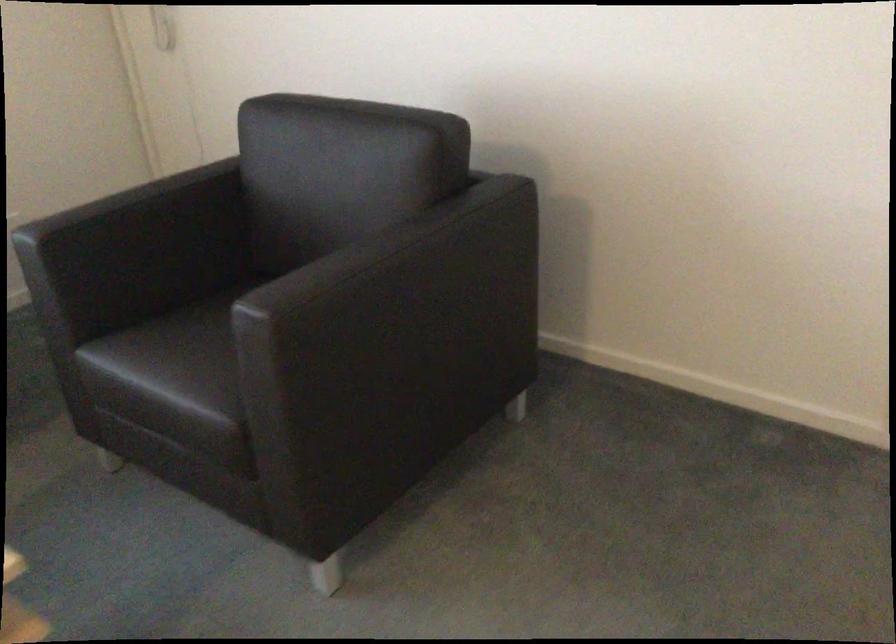
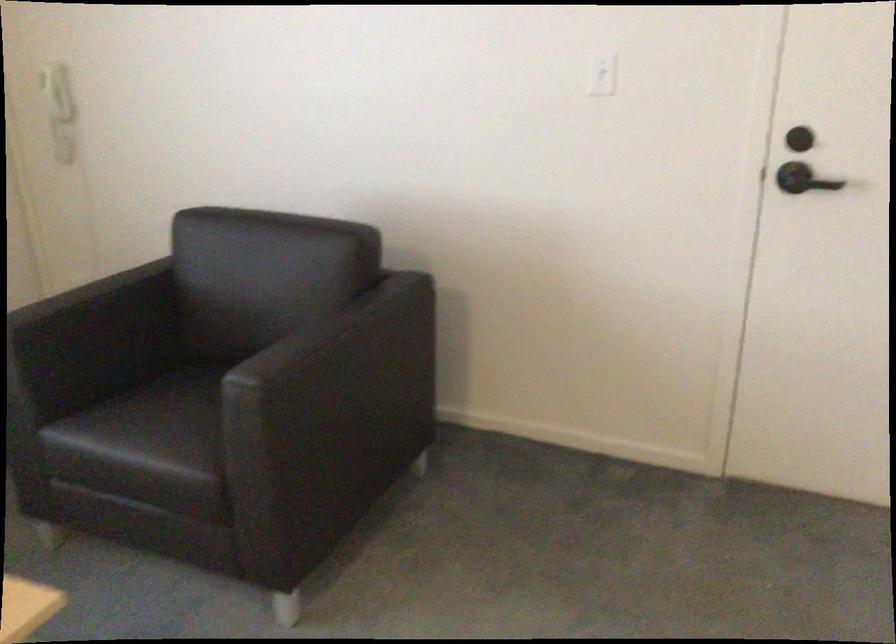
In a continuous first-person perspective shot, in which direction is the camera moving?

The cameraman moved toward left, backward.